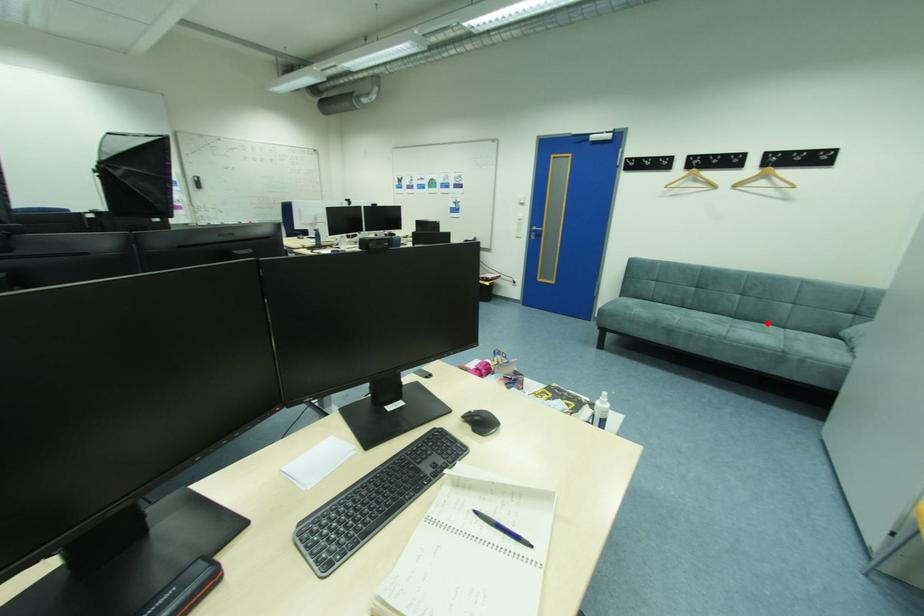
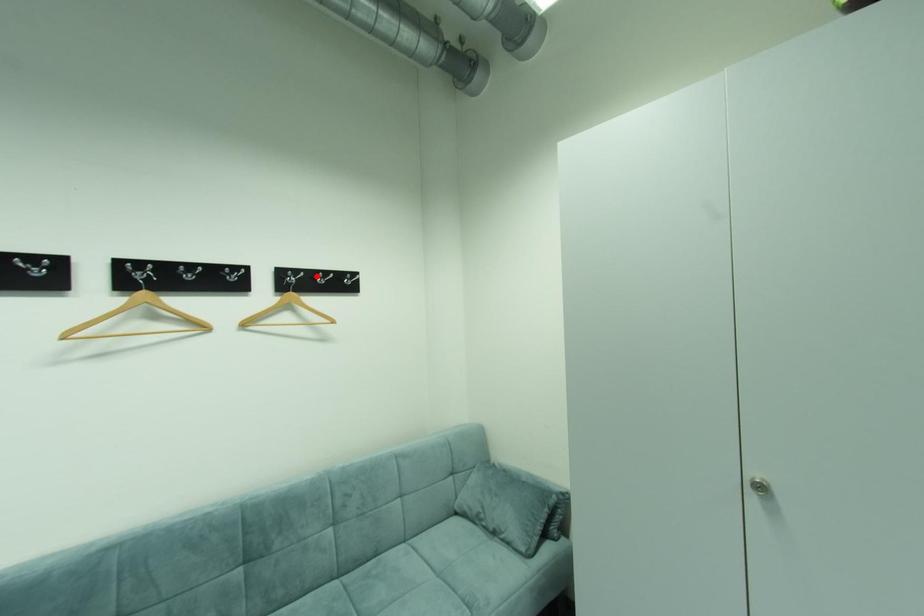
I am providing you with two images of the same scene from different viewpoints. A red point is marked on the first image and another point is marked on the second image. Do the highlighted points in image1 and image2 indicate the same real-world spot?

No